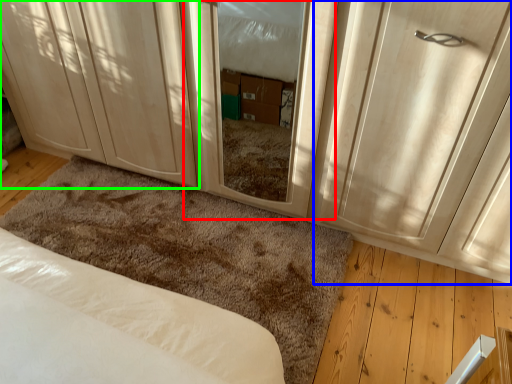
Question: Based on their relative distances, which object is nearer to screen door (highlighted by a red box)? Choose from door (highlighted by a blue box) and cabinetry (highlighted by a green box).

Choices:
 (A) door
 (B) cabinetry

Answer: (A)